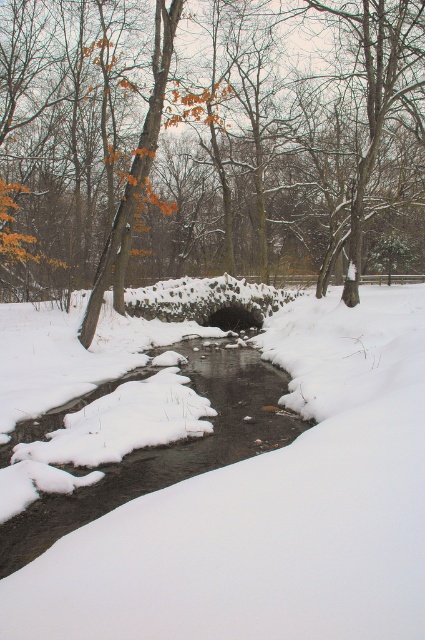
Question: Which of the following is the closest to the observer?

Choices:
 (A) brown textured rock at center
 (B) clear water at center

Answer: (B)

Question: Among these points, which one is nearest to the camera?

Choices:
 (A) (408, 12)
 (B) (81, 496)

Answer: (B)

Question: Does brown textured rock at center lie in front of clear water at center?

Choices:
 (A) no
 (B) yes

Answer: (A)

Question: Which object is farther from the camera taking this photo?

Choices:
 (A) brown textured rock at center
 (B) clear water at center

Answer: (A)

Question: Does brown textured rock at center appear on the right side of clear water at center?

Choices:
 (A) no
 (B) yes

Answer: (B)

Question: Does brown textured rock at center lie in front of clear water at center?

Choices:
 (A) yes
 (B) no

Answer: (B)